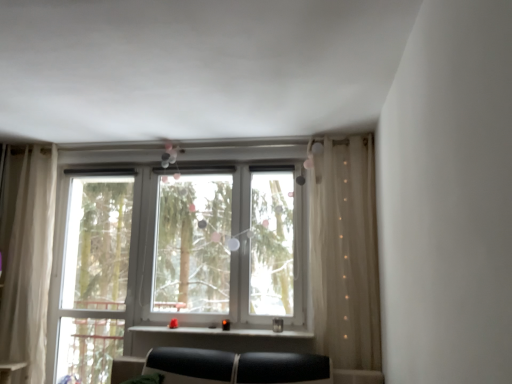
Locate an element on the screen. The image size is (512, 384). sheer white curtain at left, the 1th curtain positioned from the left is located at coordinates (30, 266).

This screenshot has height=384, width=512. I want to click on sheer beige curtain at right, the 2th curtain in the left-to-right sequence, so click(345, 253).

The width and height of the screenshot is (512, 384). What do you see at coordinates (229, 247) in the screenshot?
I see `white plastic bay window at center` at bounding box center [229, 247].

Where is `sheer white curtain at left, positioned as the 2th curtain in right-to-left order`? sheer white curtain at left, positioned as the 2th curtain in right-to-left order is located at coordinates (30, 266).

Is matte black window sill at center completely or partially inside white plastic bay window at center?

No, white plastic bay window at center does not contain matte black window sill at center.

Could you tell me if white plastic bay window at center is turned towards matte black window sill at center?

No, white plastic bay window at center does not turn towards matte black window sill at center.

From a real-world perspective, does white plastic bay window at center sit lower than matte black window sill at center?

No, from a real-world perspective, white plastic bay window at center is not beneath matte black window sill at center.

What's the angular difference between white plastic bay window at center and matte black window sill at center's facing directions?

0.00109 degrees separate the facing orientations of white plastic bay window at center and matte black window sill at center.

Is clear glass window at left far from sheer white curtain at left, the 1th curtain positioned from the left?

clear glass window at left is near sheer white curtain at left, the 1th curtain positioned from the left, not far away.

Considering the positions of objects clear glass window at left and sheer white curtain at left, the 1th curtain positioned from the left, in the image provided, who is more to the right, clear glass window at left or sheer white curtain at left, the 1th curtain positioned from the left,?

clear glass window at left.

From their relative heights in the image, would you say clear glass window at left is taller or shorter than sheer white curtain at left, positioned as the 2th curtain in right-to-left order?

clear glass window at left is shorter than sheer white curtain at left, positioned as the 2th curtain in right-to-left order.

Considering the positions of objects white plastic bay window at center and sheer white curtain at left, the 1th curtain positioned from the left, in the image provided, who is behind, white plastic bay window at center or sheer white curtain at left, the 1th curtain positioned from the left,?

sheer white curtain at left, the 1th curtain positioned from the left, is more distant.

Is white plastic bay window at center not close to sheer white curtain at left, the 1th curtain positioned from the left?

Absolutely, white plastic bay window at center is distant from sheer white curtain at left, the 1th curtain positioned from the left.

Does point (214, 250) come in front of point (31, 315)?

No, (214, 250) is further to viewer.

From a real-world perspective, which is physically below, white plastic bay window at center or clear glass window at left?

clear glass window at left, from a real-world perspective.

Can you confirm if white plastic bay window at center is shorter than clear glass window at left?

Indeed, white plastic bay window at center has a lesser height compared to clear glass window at left.

Could you tell me if white plastic bay window at center is facing clear glass window at left?

No, white plastic bay window at center is not turned towards clear glass window at left.

Considering the relative sizes of sheer white curtain at left, positioned as the 2th curtain in right-to-left order, and sheer beige curtain at right, which is the 1th curtain from right to left, in the image provided, is sheer white curtain at left, positioned as the 2th curtain in right-to-left order, taller than sheer beige curtain at right, which is the 1th curtain from right to left,?

Indeed, sheer white curtain at left, positioned as the 2th curtain in right-to-left order, has a greater height compared to sheer beige curtain at right, which is the 1th curtain from right to left.

Which object is positioned more to the left, sheer white curtain at left, positioned as the 2th curtain in right-to-left order, or sheer beige curtain at right, the 2th curtain in the left-to-right sequence?

Positioned to the left is sheer white curtain at left, positioned as the 2th curtain in right-to-left order.

Is sheer white curtain at left, the 1th curtain positioned from the left, not within sheer beige curtain at right, which is the 1th curtain from right to left?

Yes, sheer white curtain at left, the 1th curtain positioned from the left, is not within sheer beige curtain at right, which is the 1th curtain from right to left.

From the image's perspective, between sheer white curtain at left, positioned as the 2th curtain in right-to-left order, and clear glass window at left, which one is located above?

sheer white curtain at left, positioned as the 2th curtain in right-to-left order, appears higher in the image.

Which object is further away from the camera, sheer white curtain at left, the 1th curtain positioned from the left, or clear glass window at left?

clear glass window at left is further from the camera.

Looking at this image, what's the angular difference between clear glass window at left and white plastic bay window at center's facing directions?

clear glass window at left and white plastic bay window at center are facing 0.0876 degrees away from each other.

Which point is more distant from viewer, (78, 282) or (223, 278)?

The point (78, 282) is farther from the camera.

Is clear glass window at left oriented towards white plastic bay window at center?

No, clear glass window at left is not facing towards white plastic bay window at center.

Is clear glass window at left with white plastic bay window at center?

No.

Locate an element on the screen. The width and height of the screenshot is (512, 384). bay window that appears above the matte black window sill at center (from a real-world perspective) is located at coordinates (229, 247).

Where is `window frame beneath the sheer white curtain at left, the 1th curtain positioned from the left (from a real-world perspective)`? This screenshot has height=384, width=512. window frame beneath the sheer white curtain at left, the 1th curtain positioned from the left (from a real-world perspective) is located at coordinates (94, 277).

Which object lies nearer to the anchor point clear glass window at left, white plastic bay window at center or sheer white curtain at left, positioned as the 2th curtain in right-to-left order?

Among the two, sheer white curtain at left, positioned as the 2th curtain in right-to-left order, is located nearer to clear glass window at left.

Looking at the image, which one is located further to sheer white curtain at left, positioned as the 2th curtain in right-to-left order, matte black window sill at center or sheer beige curtain at right, the 2th curtain in the left-to-right sequence?

sheer beige curtain at right, the 2th curtain in the left-to-right sequence.

Looking at the image, which one is located further to sheer white curtain at left, the 1th curtain positioned from the left, white plastic bay window at center or clear glass window at left?

white plastic bay window at center is further to sheer white curtain at left, the 1th curtain positioned from the left.

Based on their spatial positions, is white plastic bay window at center or clear glass window at left further from sheer beige curtain at right, the 2th curtain in the left-to-right sequence?

Among the two, clear glass window at left is located further to sheer beige curtain at right, the 2th curtain in the left-to-right sequence.

Looking at the image, which one is located closer to sheer white curtain at left, the 1th curtain positioned from the left, white plastic bay window at center or sheer beige curtain at right, the 2th curtain in the left-to-right sequence?

white plastic bay window at center is closer to sheer white curtain at left, the 1th curtain positioned from the left.

Which object lies nearer to the anchor point clear glass window at left, sheer beige curtain at right, which is the 1th curtain from right to left, or white plastic bay window at center?

Based on the image, white plastic bay window at center appears to be nearer to clear glass window at left.

Which object lies further to the anchor point clear glass window at left, white plastic bay window at center or sheer beige curtain at right, which is the 1th curtain from right to left?

sheer beige curtain at right, which is the 1th curtain from right to left, is positioned further to the anchor clear glass window at left.

Consider the image. Based on their spatial positions, is sheer beige curtain at right, the 2th curtain in the left-to-right sequence, or clear glass window at left closer to white plastic bay window at center?

sheer beige curtain at right, the 2th curtain in the left-to-right sequence, is closer to white plastic bay window at center.

Where is `window frame between sheer white curtain at left, the 1th curtain positioned from the left, and matte black window sill at center from left to right`? This screenshot has width=512, height=384. window frame between sheer white curtain at left, the 1th curtain positioned from the left, and matte black window sill at center from left to right is located at coordinates (94, 277).

Identify the location of window frame between sheer white curtain at left, positioned as the 2th curtain in right-to-left order, and sheer beige curtain at right, the 2th curtain in the left-to-right sequence, from left to right. This screenshot has width=512, height=384. (94, 277).

The width and height of the screenshot is (512, 384). Identify the location of window sill between clear glass window at left and white plastic bay window at center. (216, 333).

The width and height of the screenshot is (512, 384). Identify the location of window sill between sheer white curtain at left, the 1th curtain positioned from the left, and sheer beige curtain at right, the 2th curtain in the left-to-right sequence, in the horizontal direction. (216, 333).